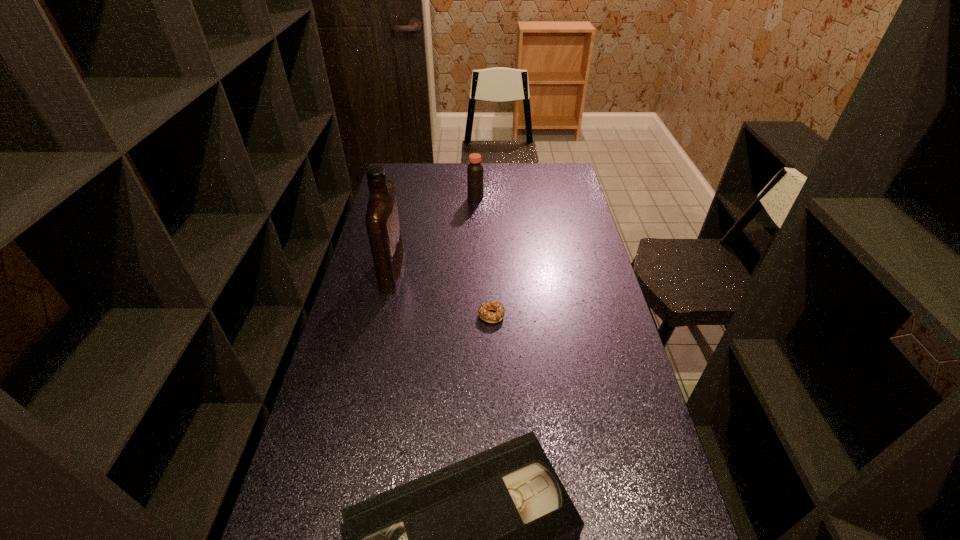
The height and width of the screenshot is (540, 960). Find the location of `the second farthest object`. the second farthest object is located at coordinates (382, 221).

Locate an element on the screen. the tallest object is located at coordinates (382, 221).

This screenshot has height=540, width=960. What are the coordinates of `vinegar` in the screenshot? It's located at (475, 169).

Locate an element on the screen. This screenshot has height=540, width=960. the farthest object is located at coordinates (475, 169).

This screenshot has height=540, width=960. What are the coordinates of `doughnut` in the screenshot? It's located at (489, 317).

What are the coordinates of `the second nearest object` in the screenshot? It's located at (489, 317).

Locate an element on the screen. This screenshot has width=960, height=540. vacant point located 0.110m on the label side of the liquor is located at coordinates (432, 269).

Locate an element on the screen. This screenshot has width=960, height=540. free space located on the front of the second tallest object is located at coordinates (474, 254).

At what (x,y) coordinates should I click in order to perform the action: click on vacant space located on the front of the doughnut. Please return your answer as a coordinate pair (x, y). Looking at the image, I should click on tap(493, 383).

The height and width of the screenshot is (540, 960). Identify the location of object that is positioned at the left edge. (382, 221).